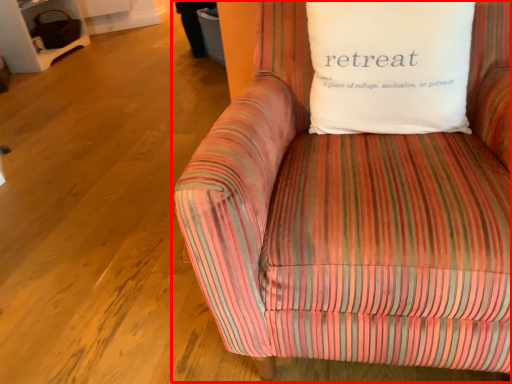
Question: From the image's perspective, what is the correct spatial positioning of studio couch (annotated by the red box) in reference to pillow?

Choices:
 (A) below
 (B) above

Answer: (A)